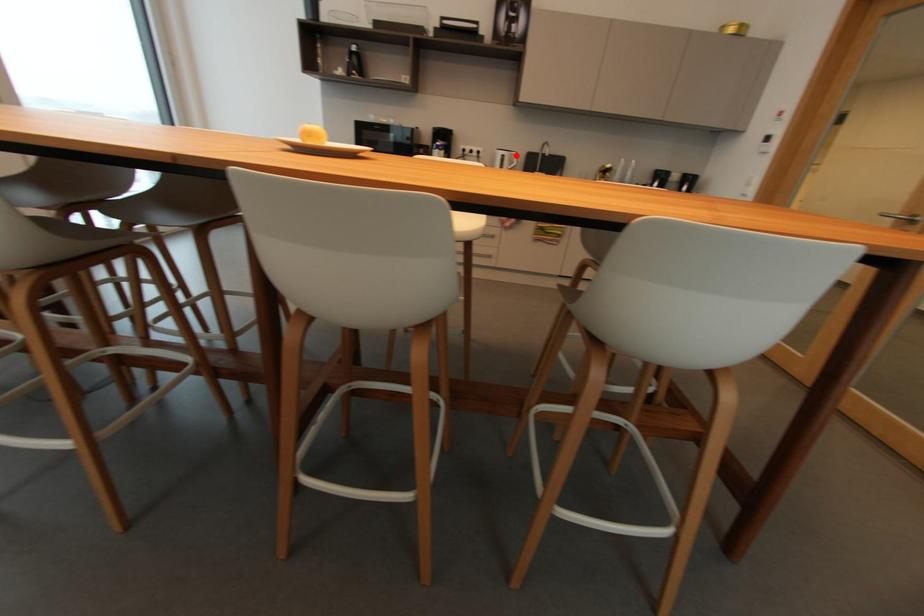
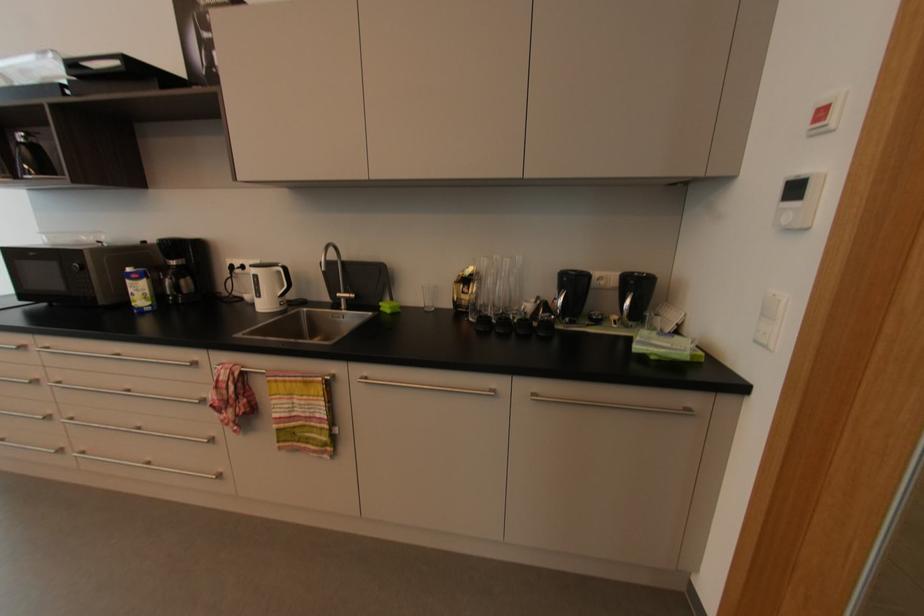
Where in the second image is the point corresponding to the highlighted location from the first image?

(282, 273)